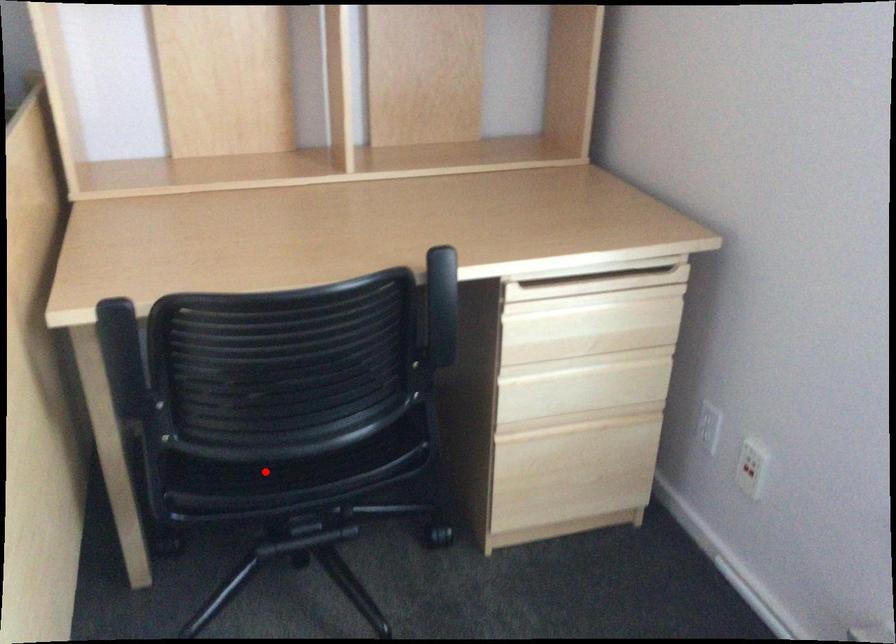
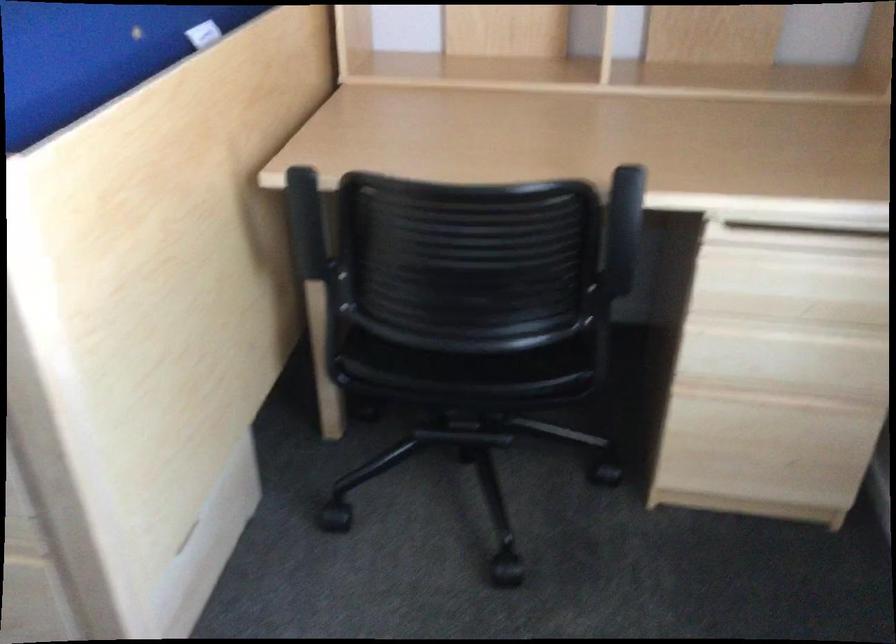
Where in the second image is the point corresponding to the highlighted location from the first image?

(433, 361)